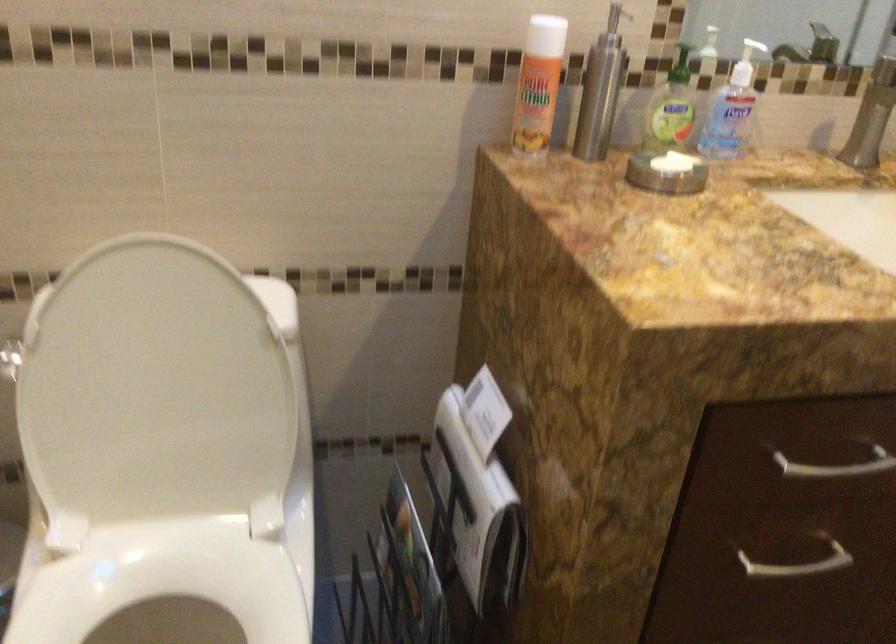
Where would you push the spray can nozzle? Please return your answer as a coordinate pair (x, y).

(546, 35)